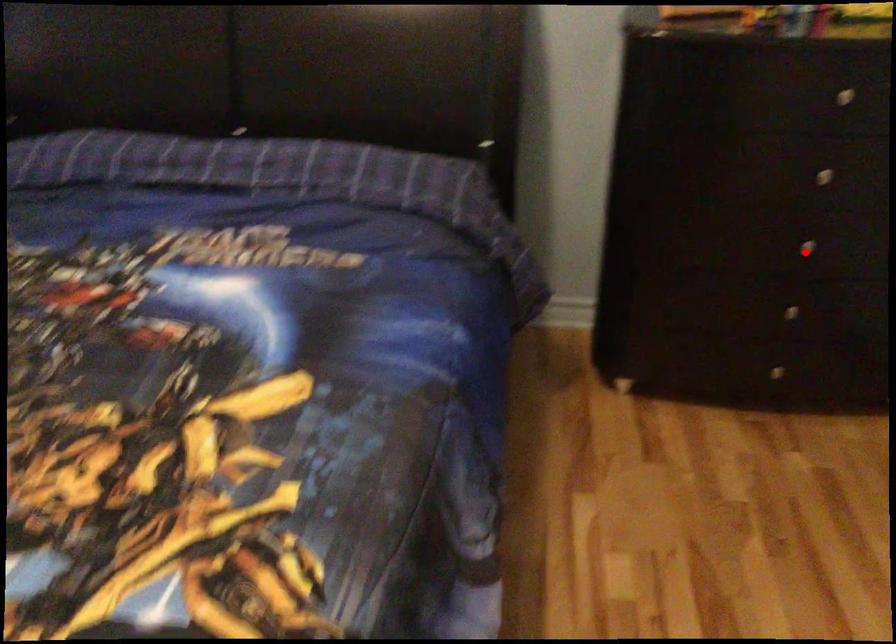
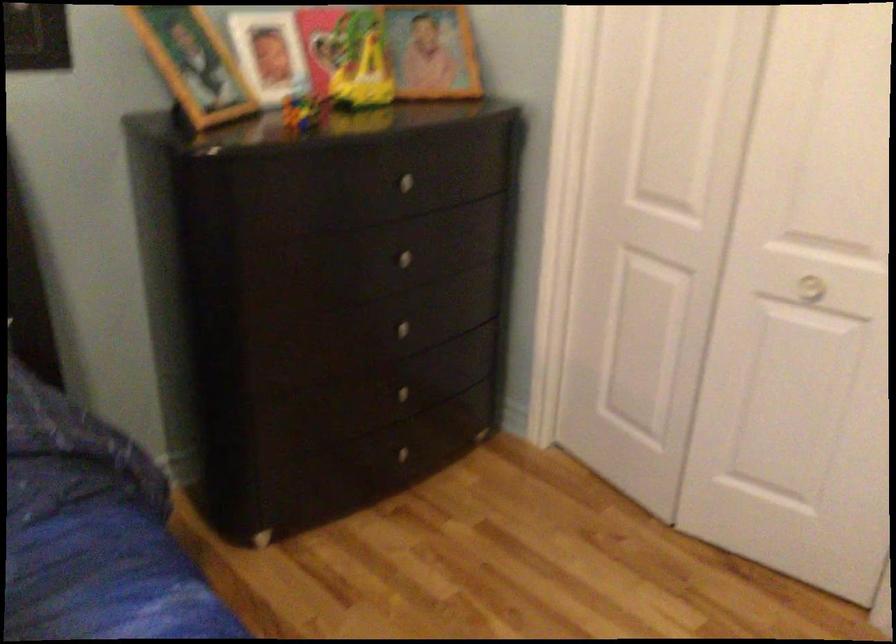
The point at the highlighted location is marked in the first image. Where is the corresponding point in the second image?

(409, 332)